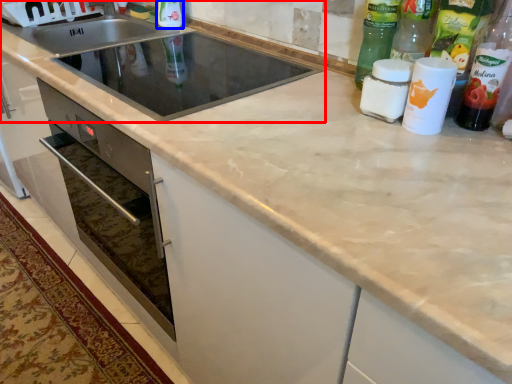
Question: Which object is closer to the camera taking this photo, sink (highlighted by a red box) or bottle (highlighted by a blue box)?

Choices:
 (A) sink
 (B) bottle

Answer: (A)